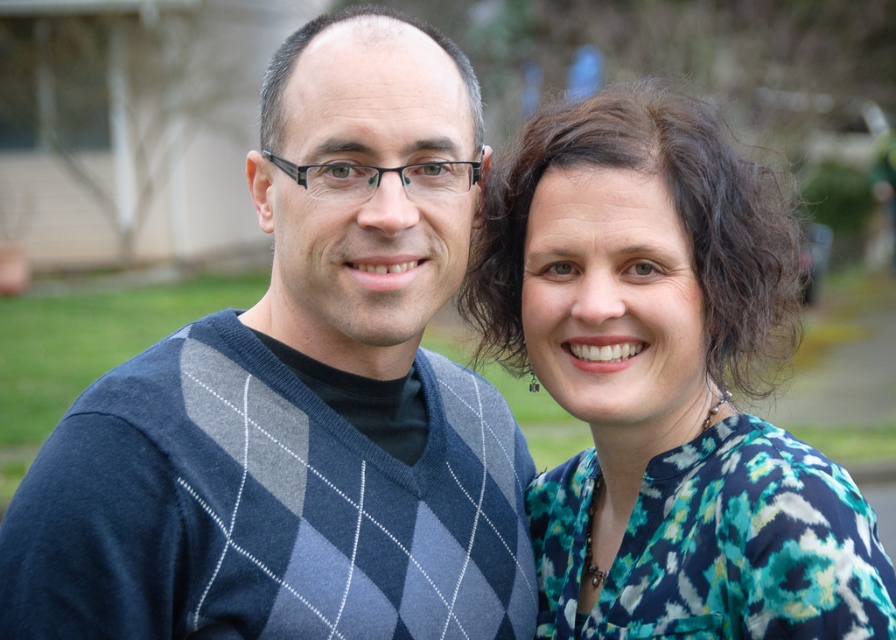
You are a photographer trying to capture a closeup of the argyle sweater at center. You have a camera with a focal length of 50mm. The point at coordinates (x=302, y=397) is part of the argyle sweater at center. To ensure the entire sweater is in focus, where should you focus your camera?

The point at coordinates (x=302, y=397) is on the argyle sweater at center, so you should focus your camera on that point to ensure the entire sweater is in focus.

You are a fashion designer who wants to place a new accessory exactly at the center of the image. However, you need to ensure that it does not overlap with the argyle sweater at center. Given that the image coordinate system has its origin at the bottom left corner, with x increasing to the right and y increasing upwards, can you determine whether the point at the center of the image is safe to place the accessory without overlapping?

The argyle sweater at center is located at point (302, 397). The center of the image would be at coordinates (448, 320). Since the distance between these points is sqrt squared differences, the accessory can be placed safely at the center without overlapping.

You are a photographer standing at a certain distance from the argyle sweater at center. You want to capture a portrait of the person wearing it while ensuring the background is slightly blurred. Given that the ideal focus distance for such a shot is between 2 and 3 meters, is your current position suitable?

The distance between you and the argyle sweater at center is 2.41 meters, which falls within the ideal focus range of 2 to 3 meters. Therefore, your current position is suitable for capturing the portrait with a blurred background.